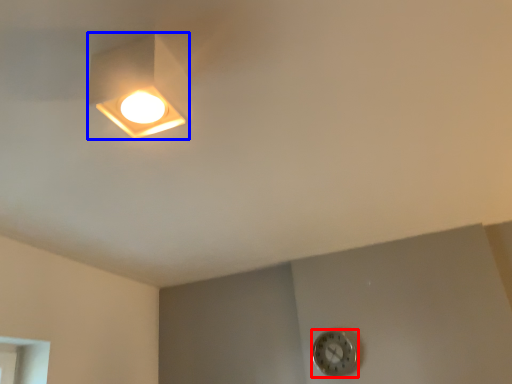
Question: Which object is further to the camera taking this photo, clock (highlighted by a red box) or lamp (highlighted by a blue box)?

Choices:
 (A) clock
 (B) lamp

Answer: (A)